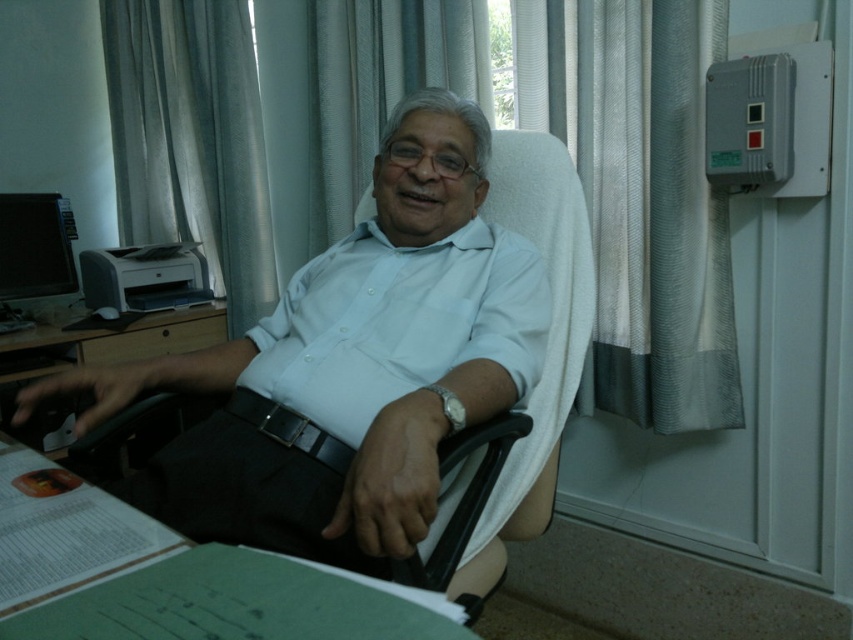
Who is lower down, white cotton shirt at center or white smooth shirt at center?

white smooth shirt at center

Can you confirm if white cotton shirt at center is smaller than white smooth shirt at center?

No.

The image size is (853, 640). Describe the element at coordinates (355, 360) in the screenshot. I see `white cotton shirt at center` at that location.

You are a GUI agent. You are given a task and a screenshot of the screen. Output one action in this format:
    pyautogui.click(x=<x>, y=<y>)
    Task: Click on the white cotton shirt at center
    
    Given the screenshot: What is the action you would take?
    pyautogui.click(x=355, y=360)

Is white textured curtain at upper center taller than white cotton shirt at center?

Yes, white textured curtain at upper center is taller than white cotton shirt at center.

Can you confirm if white textured curtain at upper center is positioned to the left of white cotton shirt at center?

Correct, you'll find white textured curtain at upper center to the left of white cotton shirt at center.

Which is in front, point (630, 33) or point (370, 358)?

Point (370, 358)

This screenshot has width=853, height=640. In order to click on white textured curtain at upper center in this screenshot , I will do point(648,208).

Based on the photo, who is more distant from viewer, (173, 125) or (131, 28)?

The point (131, 28) is more distant.

Can you confirm if white textured curtain at upper center is positioned to the right of gray fabric curtain at upper left?

Correct, you'll find white textured curtain at upper center to the right of gray fabric curtain at upper left.

Locate an element on the screen. Image resolution: width=853 pixels, height=640 pixels. white textured curtain at upper center is located at coordinates (648, 208).